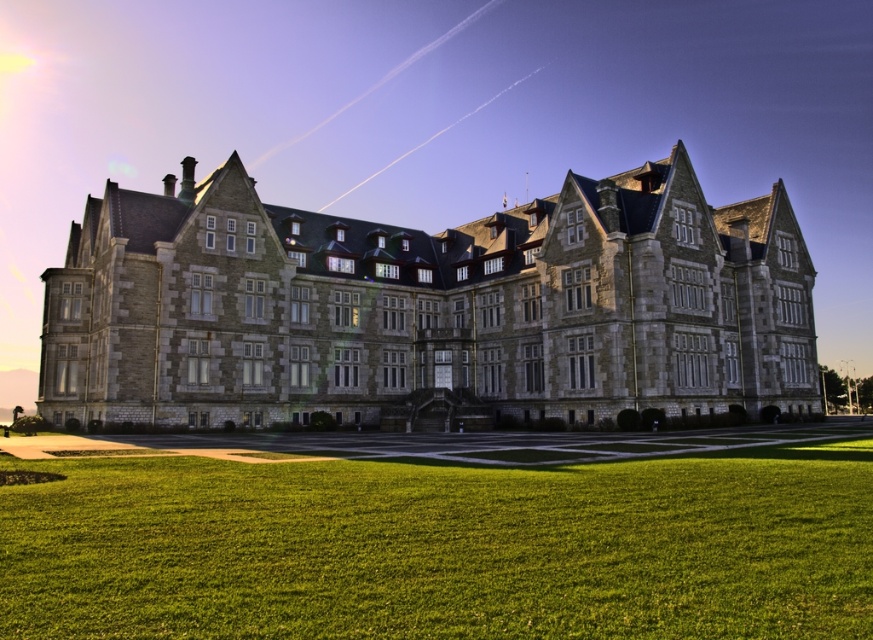
Based on the photo, you are a landscape architect planning to install a new lighting system for the stone mansion at center and the green grass at lower center. Considering their heights, which object would require taller light fixtures?

Result: The stone mansion at center requires taller light fixtures because it has a greater height compared to the green grass at lower center.

You are a landscape architect planning to install a new pathway between the stone mansion at center and the green grass at lower center. The pathway must be exactly 100 feet long. Can the pathway be installed without extending beyond the existing space between them?

The stone mansion at center and green grass at lower center are 116.71 feet apart. Since the required pathway is 100 feet long, which is shorter than the existing distance between them, the pathway can be installed within the available space without exceeding the 100 feet requirement.

You are a landscape architect designing a new garden. You need to place a decorative fountain that requires a space wider than the green grass at lower center. Can the area in front of the stone mansion at center accommodate this fountain?

The stone mansion at center might be wider than green grass at lower center, so it is uncertain if the area in front of the stone mansion at center can accommodate the fountain. Further measurements are needed to confirm the width.